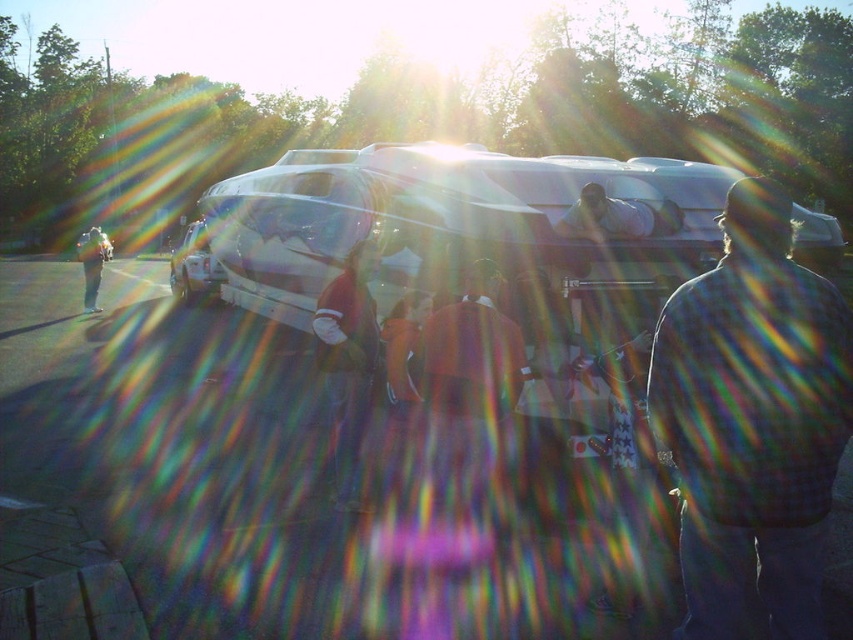
Is dark brown leather jacket at center positioned in front of light brown leather jacket at left?

Yes, dark brown leather jacket at center is in front of light brown leather jacket at left.

Identify the location of dark brown leather jacket at center. (347, 356).

Is plaid shirt at right in front of orange fabric jacket at center?

That is True.

The height and width of the screenshot is (640, 853). In order to click on plaid shirt at right in this screenshot , I will do `click(752, 420)`.

Does orange fabric jacket at center appear on the left side of light brown leather jacket at left?

In fact, orange fabric jacket at center is to the right of light brown leather jacket at left.

Is orange fabric jacket at center smaller than light brown leather jacket at left?

Indeed, orange fabric jacket at center has a smaller size compared to light brown leather jacket at left.

I want to click on orange fabric jacket at center, so click(469, 387).